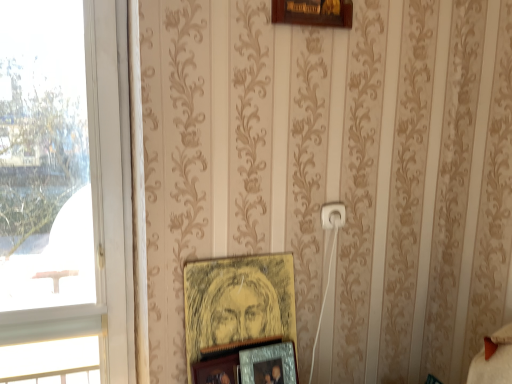
What do you see at coordinates (217, 370) in the screenshot? The height and width of the screenshot is (384, 512). I see `wooden picture frame at lower center, the third picture frame positioned from the top` at bounding box center [217, 370].

Find the location of a particular element. wooden picture frame at lower center, the third picture frame positioned from the top is located at coordinates (217, 370).

Which of these two, white plastic electric outlet at center or yellow paper picture frame at center, which is the first picture frame from top to bottom, is thinner?

white plastic electric outlet at center is thinner.

Is white plastic electric outlet at center positioned with its back to yellow paper picture frame at center, which is the first picture frame from top to bottom?

No, white plastic electric outlet at center is not facing away from yellow paper picture frame at center, which is the first picture frame from top to bottom.

Who is bigger, white plastic electric outlet at center or yellow paper picture frame at center, which is the first picture frame from top to bottom?

Bigger between the two is yellow paper picture frame at center, which is the first picture frame from top to bottom.

Is yellow paper picture frame at center, which is the first picture frame from top to bottom, surrounded by white plastic electric outlet at center?

No, yellow paper picture frame at center, which is the first picture frame from top to bottom, is not inside white plastic electric outlet at center.

Visually, is transparent glass window at left positioned to the left or to the right of metallic silver photo frame at lower center, the 2th picture frame positioned from the bottom?

Based on their positions, transparent glass window at left is located to the left of metallic silver photo frame at lower center, the 2th picture frame positioned from the bottom.

Is point (106, 90) in front of point (241, 350)?

That is False.

Identify the location of the 3rd picture frame to the right of the transparent glass window at left, counting from the anchor's position. The image size is (512, 384). (269, 364).

From the image's perspective, is transparent glass window at left located beneath metallic silver photo frame at lower center, which is the 2th picture frame from top to bottom?

No, from the image's perspective, transparent glass window at left is not beneath metallic silver photo frame at lower center, which is the 2th picture frame from top to bottom.

Could you tell me if wooden picture frame at lower center, the third picture frame positioned from the top, is turned towards metallic silver photo frame at lower center, the 2th picture frame positioned from the bottom?

No, wooden picture frame at lower center, the third picture frame positioned from the top, is not turned towards metallic silver photo frame at lower center, the 2th picture frame positioned from the bottom.

Does wooden picture frame at lower center, the third picture frame positioned from the top, have a lesser height compared to metallic silver photo frame at lower center, which is the 2th picture frame from top to bottom?

Yes.

Between wooden picture frame at lower center, the third picture frame positioned from the top, and metallic silver photo frame at lower center, the 2th picture frame positioned from the bottom, which one has smaller size?

Smaller between the two is wooden picture frame at lower center, the third picture frame positioned from the top.

Considering the positions of objects wooden picture frame at lower center, the third picture frame positioned from the top, and metallic silver photo frame at lower center, the 2th picture frame positioned from the bottom, in the image provided, who is more to the right, wooden picture frame at lower center, the third picture frame positioned from the top, or metallic silver photo frame at lower center, the 2th picture frame positioned from the bottom,?

metallic silver photo frame at lower center, the 2th picture frame positioned from the bottom, is more to the right.

Considering the positions of points (122, 227) and (270, 277), is point (122, 227) farther from camera compared to point (270, 277)?

Yes, point (122, 227) is farther from viewer.

Which is correct: transparent glass window at left is inside yellow paper picture frame at center, which is the first picture frame from top to bottom, or outside of it?

transparent glass window at left is spatially situated outside yellow paper picture frame at center, which is the first picture frame from top to bottom.

Is transparent glass window at left looking in the opposite direction of yellow paper picture frame at center, which is the first picture frame from top to bottom?

transparent glass window at left is not turned away from yellow paper picture frame at center, which is the first picture frame from top to bottom.

Do you think yellow paper picture frame at center, which is the first picture frame from top to bottom, is within white plastic electric outlet at center, or outside of it?

yellow paper picture frame at center, which is the first picture frame from top to bottom, is not enclosed by white plastic electric outlet at center.

Looking at this image, looking at their sizes, would you say yellow paper picture frame at center, which is the first picture frame from top to bottom, is wider or thinner than white plastic electric outlet at center?

Clearly, yellow paper picture frame at center, which is the first picture frame from top to bottom, has more width compared to white plastic electric outlet at center.

Does yellow paper picture frame at center, which is the first picture frame from top to bottom, appear on the right side of white plastic electric outlet at center?

In fact, yellow paper picture frame at center, which is the first picture frame from top to bottom, is to the left of white plastic electric outlet at center.

Can we say yellow paper picture frame at center, which appears as the third picture frame when ordered from the bottom, lies outside metallic silver photo frame at lower center, which is the 2th picture frame from top to bottom?

Absolutely, yellow paper picture frame at center, which appears as the third picture frame when ordered from the bottom, is external to metallic silver photo frame at lower center, which is the 2th picture frame from top to bottom.

How different are the orientations of yellow paper picture frame at center, which appears as the third picture frame when ordered from the bottom, and metallic silver photo frame at lower center, which is the 2th picture frame from top to bottom, in degrees?

They differ by 1.38 degrees in their facing directions.

Consider the image. Is yellow paper picture frame at center, which is the first picture frame from top to bottom, to the left or to the right of metallic silver photo frame at lower center, which is the 2th picture frame from top to bottom, in the image?

From the image, it's evident that yellow paper picture frame at center, which is the first picture frame from top to bottom, is to the left of metallic silver photo frame at lower center, which is the 2th picture frame from top to bottom.

Are yellow paper picture frame at center, which appears as the third picture frame when ordered from the bottom, and metallic silver photo frame at lower center, which is the 2th picture frame from top to bottom, located far from each other?

yellow paper picture frame at center, which appears as the third picture frame when ordered from the bottom, is actually quite close to metallic silver photo frame at lower center, which is the 2th picture frame from top to bottom.

Is yellow paper picture frame at center, which appears as the third picture frame when ordered from the bottom, thinner than transparent glass window at left?

Correct, the width of yellow paper picture frame at center, which appears as the third picture frame when ordered from the bottom, is less than that of transparent glass window at left.

From the image's perspective, is yellow paper picture frame at center, which appears as the third picture frame when ordered from the bottom, above transparent glass window at left?

No.

Is yellow paper picture frame at center, which appears as the third picture frame when ordered from the bottom, spatially inside transparent glass window at left, or outside of it?

yellow paper picture frame at center, which appears as the third picture frame when ordered from the bottom, is located beyond the bounds of transparent glass window at left.

Is yellow paper picture frame at center, which is the first picture frame from top to bottom, turned away from transparent glass window at left?

No, yellow paper picture frame at center, which is the first picture frame from top to bottom, is not facing the opposite direction of transparent glass window at left.

Locate an element on the screen. This screenshot has height=384, width=512. electric outlet located above the yellow paper picture frame at center, which appears as the third picture frame when ordered from the bottom (from the image's perspective) is located at coordinates (333, 215).

This screenshot has width=512, height=384. I want to click on the 3rd picture frame directly beneath the transparent glass window at left (from a real-world perspective), so click(x=269, y=364).

Looking at the image, which one is located further to yellow paper picture frame at center, which is the first picture frame from top to bottom, wooden picture frame at lower center, the first picture frame in the bottom-to-top sequence, or metallic silver photo frame at lower center, which is the 2th picture frame from top to bottom?

Among the two, wooden picture frame at lower center, the first picture frame in the bottom-to-top sequence, is located further to yellow paper picture frame at center, which is the first picture frame from top to bottom.

Considering their positions, is yellow paper picture frame at center, which is the first picture frame from top to bottom, positioned closer to metallic silver photo frame at lower center, the 2th picture frame positioned from the bottom, than white plastic electric outlet at center?

The object closer to metallic silver photo frame at lower center, the 2th picture frame positioned from the bottom, is yellow paper picture frame at center, which is the first picture frame from top to bottom.

Considering their positions, is white plastic electric outlet at center positioned further to yellow paper picture frame at center, which is the first picture frame from top to bottom, than wooden picture frame at lower center, the first picture frame in the bottom-to-top sequence?

white plastic electric outlet at center lies further to yellow paper picture frame at center, which is the first picture frame from top to bottom, than the other object.

Based on their spatial positions, is wooden picture frame at lower center, the third picture frame positioned from the top, or yellow paper picture frame at center, which is the first picture frame from top to bottom, closer to white plastic electric outlet at center?

Among the two, yellow paper picture frame at center, which is the first picture frame from top to bottom, is located nearer to white plastic electric outlet at center.

When comparing their distances from metallic silver photo frame at lower center, which is the 2th picture frame from top to bottom, does wooden picture frame at lower center, the third picture frame positioned from the top, or white plastic electric outlet at center seem closer?

The object closer to metallic silver photo frame at lower center, which is the 2th picture frame from top to bottom, is wooden picture frame at lower center, the third picture frame positioned from the top.

Looking at the image, which one is located further to transparent glass window at left, white plastic electric outlet at center or wooden picture frame at lower center, the first picture frame in the bottom-to-top sequence?

Based on the image, white plastic electric outlet at center appears to be further to transparent glass window at left.

Which object lies nearer to the anchor point transparent glass window at left, white plastic electric outlet at center or metallic silver photo frame at lower center, the 2th picture frame positioned from the bottom?

metallic silver photo frame at lower center, the 2th picture frame positioned from the bottom, is closer to transparent glass window at left.

Which object lies nearer to the anchor point metallic silver photo frame at lower center, the 2th picture frame positioned from the bottom, yellow paper picture frame at center, which appears as the third picture frame when ordered from the bottom, or wooden picture frame at lower center, the first picture frame in the bottom-to-top sequence?

wooden picture frame at lower center, the first picture frame in the bottom-to-top sequence, lies closer to metallic silver photo frame at lower center, the 2th picture frame positioned from the bottom, than the other object.

At what (x,y) coordinates should I click in order to perform the action: click on picture frame between white plastic electric outlet at center and metallic silver photo frame at lower center, which is the 2th picture frame from top to bottom, from top to bottom. Please return your answer as a coordinate pair (x, y). This screenshot has width=512, height=384. Looking at the image, I should click on click(237, 301).

Identify the location of picture frame between transparent glass window at left and yellow paper picture frame at center, which is the first picture frame from top to bottom, from left to right. (217, 370).

Identify the location of picture frame between yellow paper picture frame at center, which appears as the third picture frame when ordered from the bottom, and wooden picture frame at lower center, the first picture frame in the bottom-to-top sequence, from top to bottom. The height and width of the screenshot is (384, 512). (269, 364).